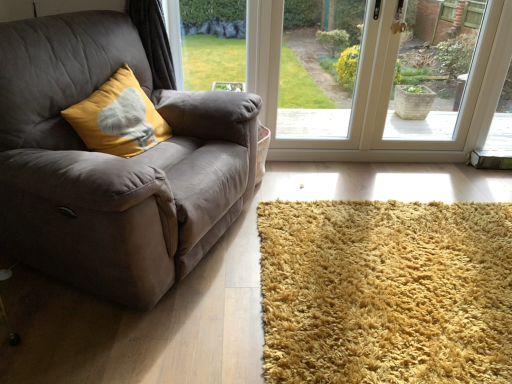
Locate an element on the screen. free space in front of transparent glass window at center is located at coordinates (305, 204).